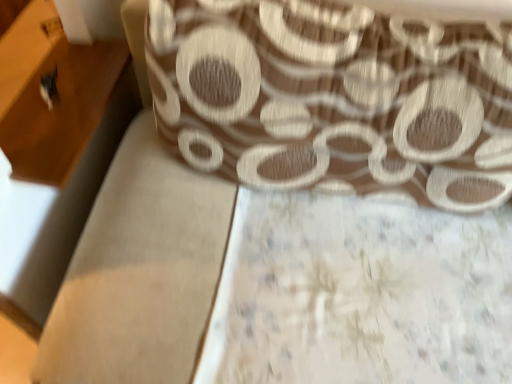
Describe the element at coordinates (42, 124) in the screenshot. The image size is (512, 384). I see `wooden drawer at left` at that location.

At what (x,y) coordinates should I click in order to perform the action: click on wooden drawer at left. Please return your answer as a coordinate pair (x, y). Looking at the image, I should click on (42, 124).

What do you see at coordinates (335, 98) in the screenshot? I see `brown textured fabric at upper center` at bounding box center [335, 98].

Measure the distance between point (257, 42) and camera.

Point (257, 42) and camera are 30.51 inches apart.

Identify the location of brown textured fabric at upper center. (335, 98).

This screenshot has width=512, height=384. In order to click on wooden drawer at left in this screenshot , I will do `click(42, 124)`.

In the image, is wooden drawer at left on the left side or the right side of brown textured fabric at upper center?

Clearly, wooden drawer at left is on the left of brown textured fabric at upper center in the image.

Which is behind, wooden drawer at left or brown textured fabric at upper center?

wooden drawer at left is behind.

Between point (25, 161) and point (290, 136), which one is positioned in front?

Point (290, 136)

Consider the image. From the image's perspective, is wooden drawer at left located beneath brown textured fabric at upper center?

No.

From a real-world perspective, is wooden drawer at left below brown textured fabric at upper center?

Correct, in the physical world, wooden drawer at left is lower than brown textured fabric at upper center.

Between wooden drawer at left and brown textured fabric at upper center, which one has larger width?

Wider between the two is brown textured fabric at upper center.

Considering the relative sizes of wooden drawer at left and brown textured fabric at upper center in the image provided, is wooden drawer at left shorter than brown textured fabric at upper center?

Yes.

Can you confirm if wooden drawer at left is bigger than brown textured fabric at upper center?

Incorrect, wooden drawer at left is not larger than brown textured fabric at upper center.

Is wooden drawer at left outside of brown textured fabric at upper center?

Indeed, wooden drawer at left is completely outside brown textured fabric at upper center.

Is wooden drawer at left far away from brown textured fabric at upper center?

No.

From the picture: Is wooden drawer at left aimed at brown textured fabric at upper center?

Yes, wooden drawer at left is turned towards brown textured fabric at upper center.

The width and height of the screenshot is (512, 384). In order to click on drawer that is above the brown textured fabric at upper center (from the image's perspective) in this screenshot , I will do `click(42, 124)`.

Which object is positioned more to the left, brown textured fabric at upper center or wooden drawer at left?

From the viewer's perspective, wooden drawer at left appears more on the left side.

Which object is further away from the camera, brown textured fabric at upper center or wooden drawer at left?

wooden drawer at left is more distant.

Does point (367, 60) lie behind point (65, 106)?

That is False.

From the image's perspective, between brown textured fabric at upper center and wooden drawer at left, which one is located above?

wooden drawer at left appears higher in the image.

From a real-world perspective, is brown textured fabric at upper center located beneath wooden drawer at left?

No.

Consider the image. Does brown textured fabric at upper center have a greater width compared to wooden drawer at left?

Correct, the width of brown textured fabric at upper center exceeds that of wooden drawer at left.

Considering the sizes of brown textured fabric at upper center and wooden drawer at left in the image, is brown textured fabric at upper center taller or shorter than wooden drawer at left?

brown textured fabric at upper center is taller than wooden drawer at left.

Considering the sizes of objects brown textured fabric at upper center and wooden drawer at left in the image provided, who is smaller, brown textured fabric at upper center or wooden drawer at left?

Smaller between the two is wooden drawer at left.

Is brown textured fabric at upper center outside of wooden drawer at left?

Yes, brown textured fabric at upper center is not within wooden drawer at left.

Is the surface of brown textured fabric at upper center in direct contact with wooden drawer at left?

No.

Is wooden drawer at left at the back of brown textured fabric at upper center?

No, brown textured fabric at upper center's orientation is not away from wooden drawer at left.

What's the angular difference between brown textured fabric at upper center and wooden drawer at left's facing directions?

91.1 degrees separate the facing orientations of brown textured fabric at upper center and wooden drawer at left.

Measure the distance from brown textured fabric at upper center to wooden drawer at left.

brown textured fabric at upper center is 20.88 inches from wooden drawer at left.

The height and width of the screenshot is (384, 512). I want to click on curtain that is in front of the wooden drawer at left, so click(x=335, y=98).

Identify the location of drawer behind the brown textured fabric at upper center. The image size is (512, 384). (42, 124).

Locate an element on the screen. The width and height of the screenshot is (512, 384). drawer that is on the left side of brown textured fabric at upper center is located at coordinates (42, 124).